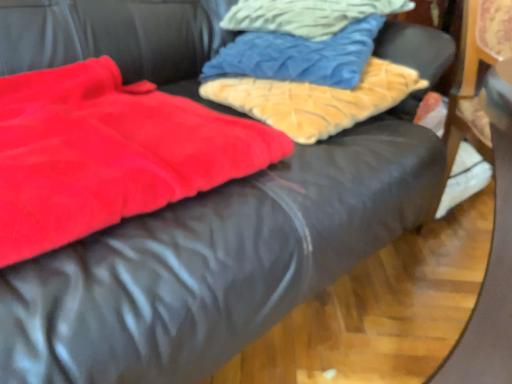
Question: Which direction should I rotate to look at fuzzy beige pillow at upper center, the third cloth from the top?

Choices:
 (A) right
 (B) left

Answer: (A)

Question: Considering the relative sizes of velvet blue pillow at upper center, positioned as the first cloth in top-to-bottom order, and fuzzy beige pillow at upper center, the third cloth from the top, in the image provided, is velvet blue pillow at upper center, positioned as the first cloth in top-to-bottom order, thinner than fuzzy beige pillow at upper center, the third cloth from the top,?

Choices:
 (A) yes
 (B) no

Answer: (A)

Question: From the image's perspective, is velvet blue pillow at upper center, positioned as the first cloth in top-to-bottom order, located beneath fuzzy beige pillow at upper center, the 1th cloth from the bottom?

Choices:
 (A) yes
 (B) no

Answer: (B)

Question: From a real-world perspective, is velvet blue pillow at upper center, positioned as the first cloth in top-to-bottom order, on fuzzy beige pillow at upper center, the third cloth from the top?

Choices:
 (A) no
 (B) yes

Answer: (B)

Question: Does velvet blue pillow at upper center, positioned as the first cloth in top-to-bottom order, appear on the left side of fuzzy beige pillow at upper center, the third cloth from the top?

Choices:
 (A) no
 (B) yes

Answer: (A)

Question: Is fuzzy beige pillow at upper center, the third cloth from the top, at the back of velvet blue pillow at upper center, positioned as the first cloth in top-to-bottom order?

Choices:
 (A) no
 (B) yes

Answer: (A)

Question: Is velvet blue pillow at upper center, which is the third cloth in bottom-to-top order, outside fuzzy beige pillow at upper center, the third cloth from the top?

Choices:
 (A) no
 (B) yes

Answer: (B)

Question: Considering the relative sizes of velvet blue pillow at upper center, the 2th cloth positioned from the bottom, and velvet blue pillow at upper center, which is the third cloth in bottom-to-top order, in the image provided, is velvet blue pillow at upper center, the 2th cloth positioned from the bottom, thinner than velvet blue pillow at upper center, which is the third cloth in bottom-to-top order,?

Choices:
 (A) no
 (B) yes

Answer: (B)

Question: Is velvet blue pillow at upper center, the 2th cloth from the top, behind velvet blue pillow at upper center, positioned as the first cloth in top-to-bottom order?

Choices:
 (A) no
 (B) yes

Answer: (A)

Question: Is velvet blue pillow at upper center, the 2th cloth from the top, taller than velvet blue pillow at upper center, positioned as the first cloth in top-to-bottom order?

Choices:
 (A) yes
 (B) no

Answer: (A)

Question: From a real-world perspective, is velvet blue pillow at upper center, the 2th cloth positioned from the bottom, physically above velvet blue pillow at upper center, which is the third cloth in bottom-to-top order?

Choices:
 (A) yes
 (B) no

Answer: (B)

Question: Considering the relative sizes of velvet blue pillow at upper center, the 2th cloth from the top, and velvet blue pillow at upper center, positioned as the first cloth in top-to-bottom order, in the image provided, is velvet blue pillow at upper center, the 2th cloth from the top, shorter than velvet blue pillow at upper center, positioned as the first cloth in top-to-bottom order,?

Choices:
 (A) yes
 (B) no

Answer: (B)

Question: Considering the relative positions of velvet blue pillow at upper center, the 2th cloth from the top, and velvet blue pillow at upper center, which is the third cloth in bottom-to-top order, in the image provided, is velvet blue pillow at upper center, the 2th cloth from the top, to the right of velvet blue pillow at upper center, which is the third cloth in bottom-to-top order, from the viewer's perspective?

Choices:
 (A) no
 (B) yes

Answer: (A)

Question: Can you confirm if fuzzy beige pillow at upper center, the third cloth from the top, is positioned to the right of velvet blue pillow at upper center, which is the third cloth in bottom-to-top order?

Choices:
 (A) yes
 (B) no

Answer: (B)